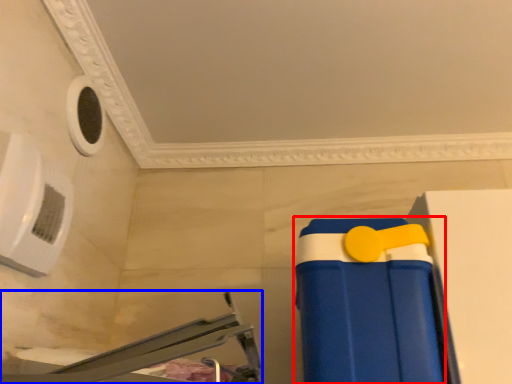
Question: Among these objects, which one is nearest to the camera, toy (highlighted by a red box) or furniture (highlighted by a blue box)?

Choices:
 (A) toy
 (B) furniture

Answer: (B)